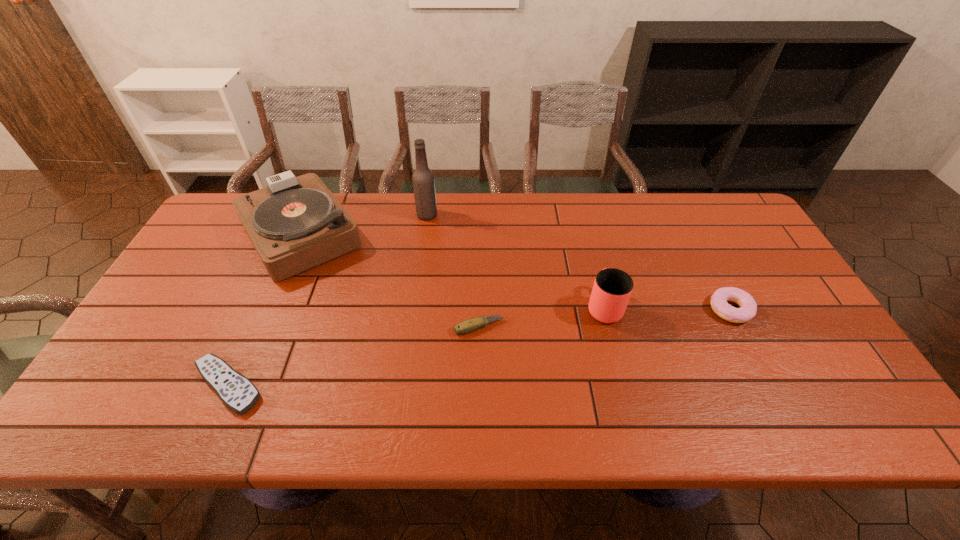
Locate an element on the screen. The width and height of the screenshot is (960, 540). empty space between the rightmost object and the remote control is located at coordinates (479, 348).

Where is `free space that is in between the pocketknife and the fifth object from left to right`? free space that is in between the pocketknife and the fifth object from left to right is located at coordinates (541, 316).

The height and width of the screenshot is (540, 960). What are the coordinates of `free spot between the record player and the third object from right to left` in the screenshot? It's located at (390, 280).

Locate an element on the screen. vacant region between the nearest object and the doughnut is located at coordinates (479, 348).

Find the location of a particular element. Image resolution: width=960 pixels, height=540 pixels. vacant point located between the beer bottle and the rightmost object is located at coordinates (579, 262).

At what (x,y) coordinates should I click in order to perform the action: click on empty space between the second object from right to left and the beer bottle. Please return your answer as a coordinate pair (x, y). Looking at the image, I should click on (516, 260).

The image size is (960, 540). Find the location of `empty space between the cup and the tallest object`. empty space between the cup and the tallest object is located at coordinates (516, 260).

Where is `empty space between the rightmost object and the nearest object`? empty space between the rightmost object and the nearest object is located at coordinates (479, 348).

Locate an element on the screen. This screenshot has height=540, width=960. object identified as the fourth closest to the cup is located at coordinates click(295, 223).

Find the location of a particular element. The width and height of the screenshot is (960, 540). object that is the third closest one to the fifth object from left to right is located at coordinates (423, 181).